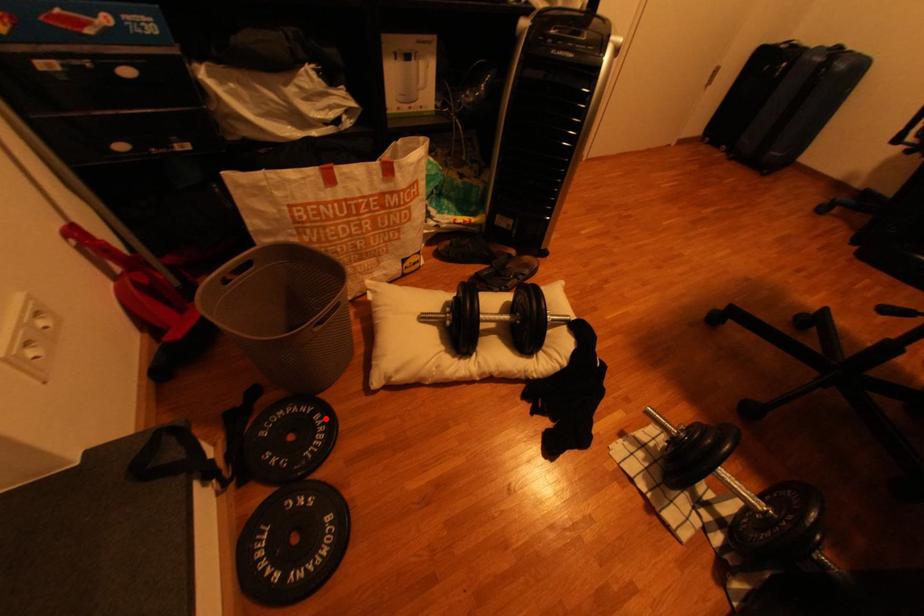
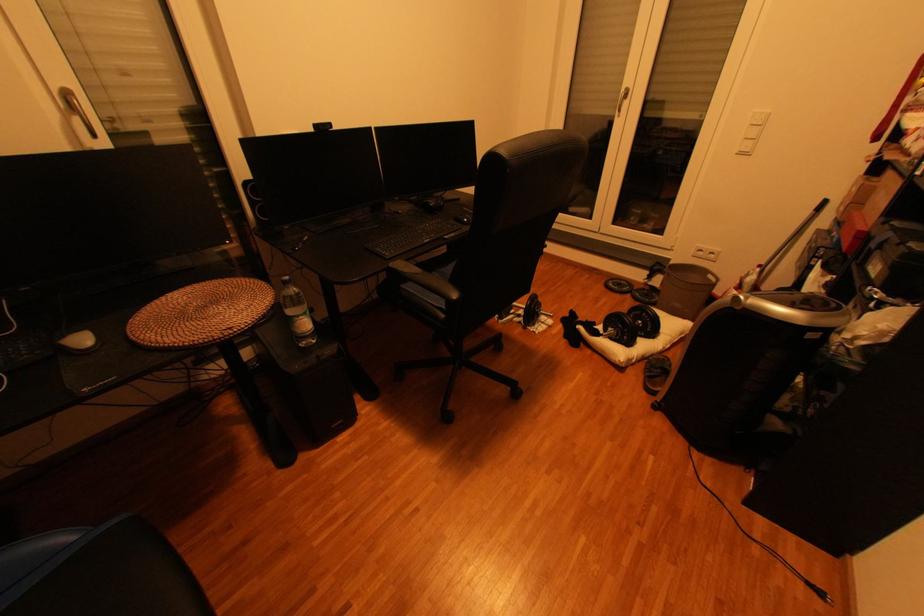
Question: I am providing you with two images of the same scene from different viewpoints. Image1 has a red point marked. In image2, the corresponding 3D location appears at what relative position? Reply with the corresponding letter.

Choices:
 (A) Closer
 (B) Farther

Answer: (B)